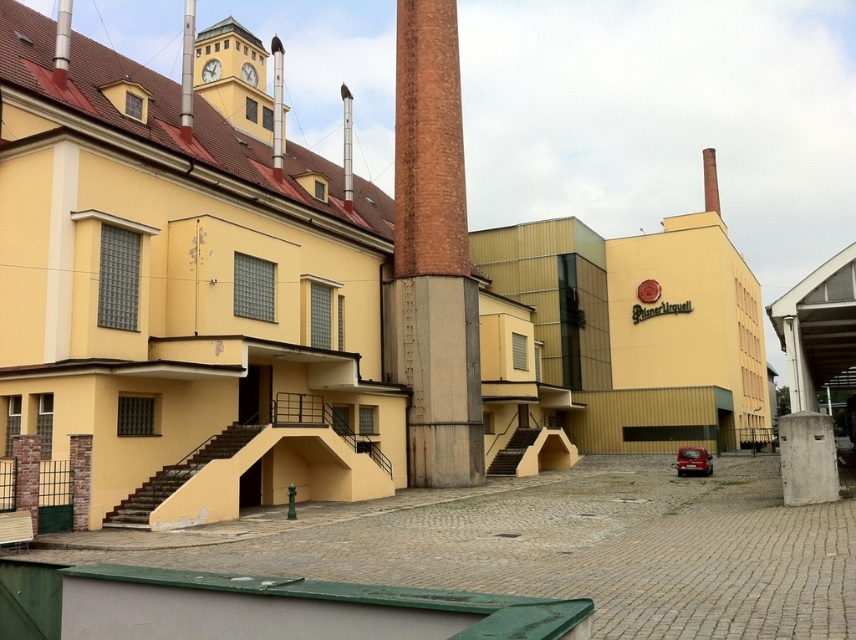
Who is shorter, metallic clock face at upper center or metallic clock at upper center?

With less height is metallic clock at upper center.

Who is taller, metallic clock face at upper center or metallic clock at upper center?

metallic clock face at upper center is taller.

Find the location of a particular element. metallic clock face at upper center is located at coordinates (211, 70).

Which is in front, point (712, 204) or point (214, 76)?

Point (214, 76) is more forward.

Is brown brick chimney at upper center further to the viewer compared to metallic clock face at upper center?

Yes, it is.

Who is more distant from viewer, (702, 154) or (207, 72)?

The point (702, 154) is more distant.

At what (x,y) coordinates should I click in order to perform the action: click on brown brick chimney at upper center. Please return your answer as a coordinate pair (x, y). The height and width of the screenshot is (640, 856). Looking at the image, I should click on (710, 180).

The height and width of the screenshot is (640, 856). In order to click on brown brick chimney at upper center in this screenshot , I will do `click(710, 180)`.

Identify the location of brown brick chimney at upper center. This screenshot has width=856, height=640. (710, 180).